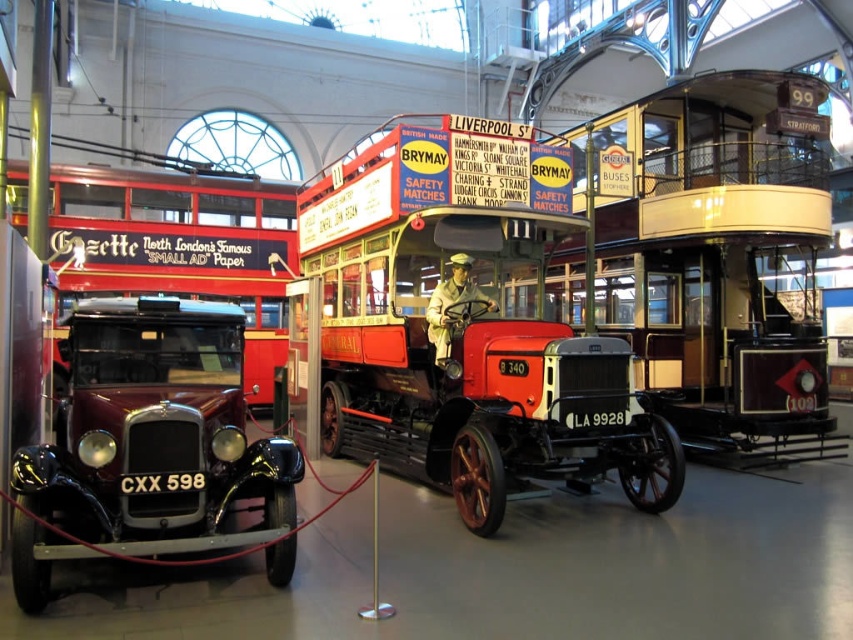
You are a tour guide leading a group through the museum. You need to explain the layout of the exhibit to your visitors. Which of the two vehicles, the matte black bus at center or the matte red coach at center, takes up more floor space in the exhibit hall?

The matte red coach at center takes up more floor space than the matte black bus at center because the matte black bus at center occupies less space than matte red coach at center.